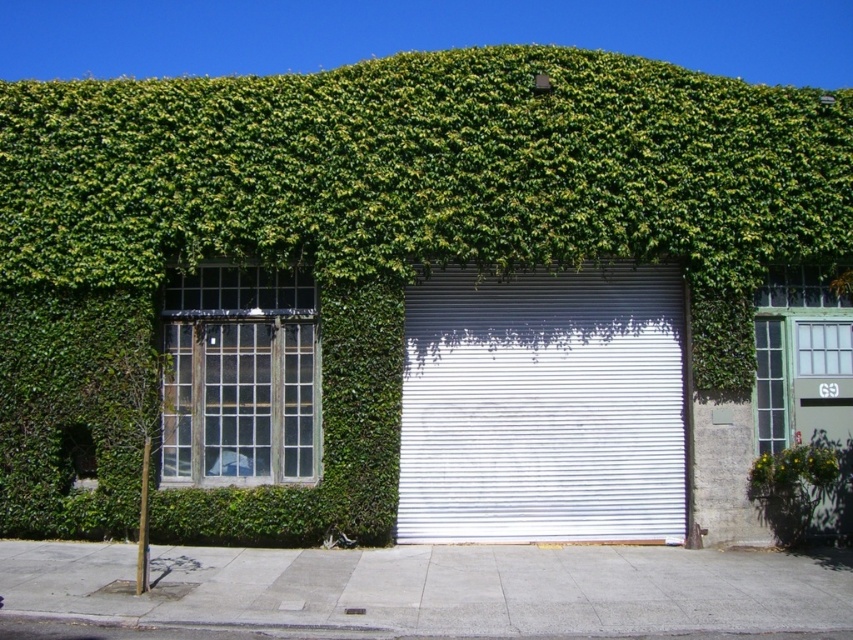
You are a painter trying to estimate the amount of paint needed to cover the white metallic garage door at center and the green leafy plant at lower right. Which object requires more paint based on their sizes?

The white metallic garage door at center requires more paint because its width is larger than the green leafy plant at lower right.

You are a delivery person trying to access the garage through the white metallic garage door at center. You notice a green leafy plant at lower right nearby. Which object is located higher up on the wall?

The white metallic garage door at center is positioned over the green leafy plant at lower right, so the garage door is higher up on the wall.

You are a painter who needs to paint the white metallic garage door at center and the green leafy plant at lower right. Which object requires a taller ladder to reach its top?

The white metallic garage door at center requires a taller ladder because it has a greater height compared to the green leafy plant at lower right.